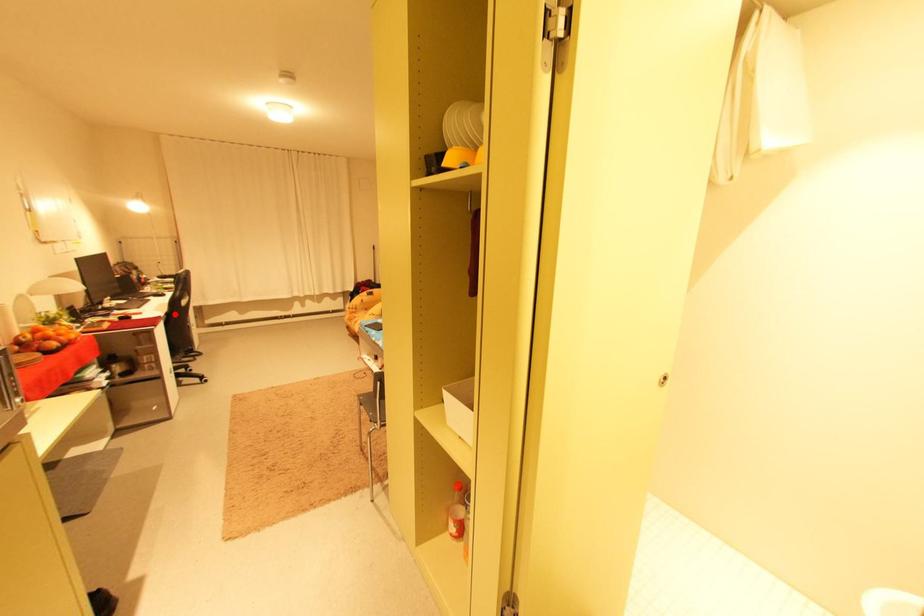
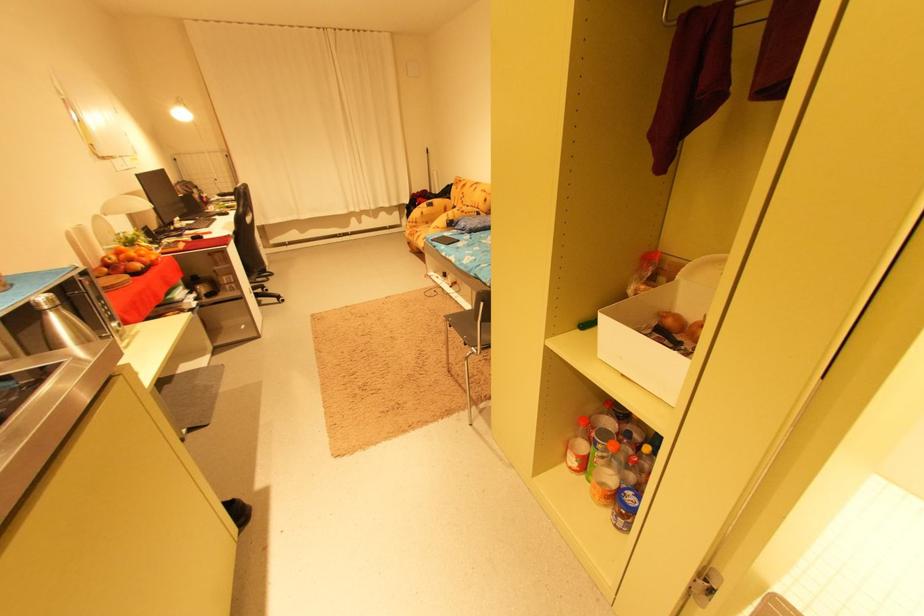
The point at the highlighted location is marked in the first image. Where is the corresponding point in the second image?

(242, 233)